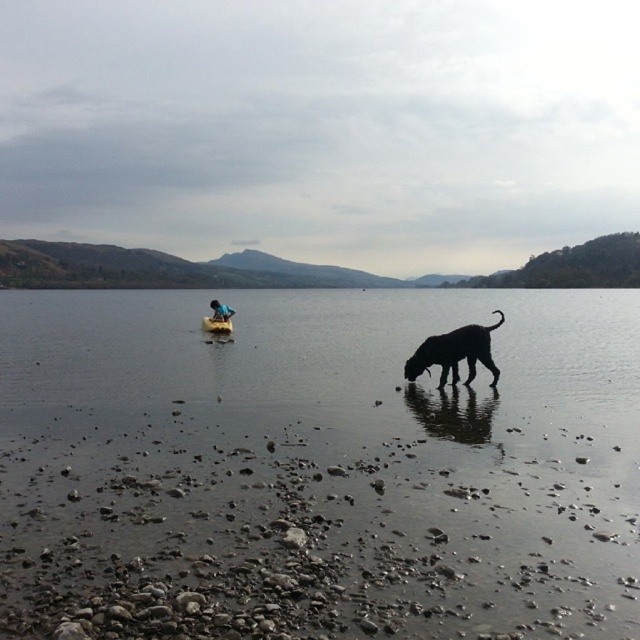
You are a photographer positioned at the camera. You want to take a photo of two points in the scene. The first point is point (404, 374) and the second point is point (212, 330). Which point will appear larger in your photo?

Point (404, 374) is closer to the camera than point (212, 330), so it will appear larger in the photo.

You are planning to take a photo of the black fur dog at lower center and the wooden canoe at center. Which object is wider in the image?

The black fur dog at lower center is wider than the wooden canoe at center according to the description.

You are planning to take a short swim in the lake. Based on the scene, which object would you avoid stepping into to ensure safety? Please choose between the clear water at shore center and the wooden canoe at center.

The clear water at shore center is bigger than the wooden canoe at center, so stepping into the clear water at shore center might be riskier due to its larger size and depth compared to the wooden canoe at center.